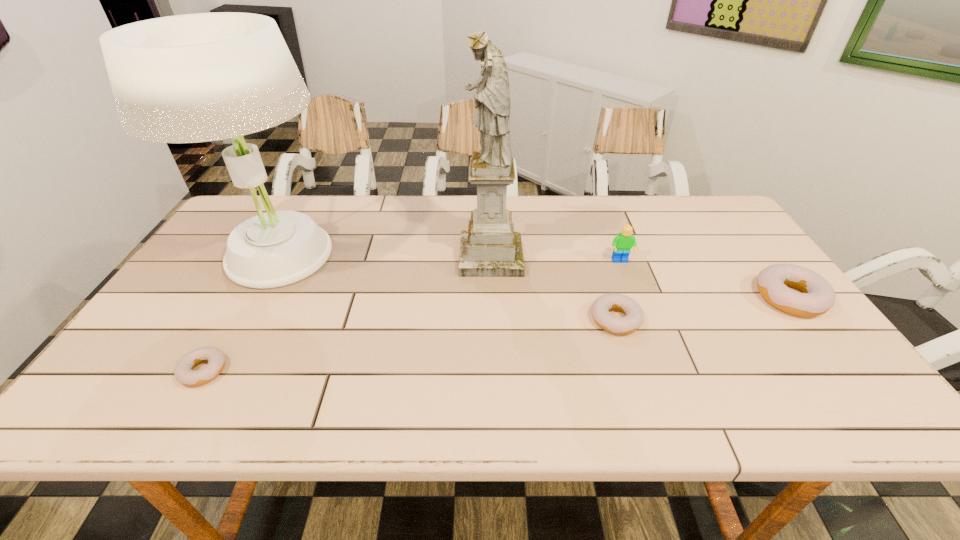
Where is `free space located 0.260m on the right of the second tallest doughnut`? This screenshot has width=960, height=540. free space located 0.260m on the right of the second tallest doughnut is located at coordinates (745, 320).

This screenshot has width=960, height=540. I want to click on free space located on the front of the tallest doughnut, so click(850, 375).

Locate an element on the screen. The height and width of the screenshot is (540, 960). vacant area located 0.340m on the front-facing side of the sculpture is located at coordinates (343, 256).

You are a GUI agent. You are given a task and a screenshot of the screen. Output one action in this format:
    pyautogui.click(x=<x>, y=<y>)
    Task: Click on the free region located on the front-facing side of the sculpture
    
    Given the screenshot: What is the action you would take?
    pyautogui.click(x=384, y=256)

This screenshot has width=960, height=540. I want to click on vacant space located on the front-facing side of the sculpture, so click(x=432, y=256).

Locate an element on the screen. The width and height of the screenshot is (960, 540). vacant point located 0.110m on the front-facing side of the lamp is located at coordinates (233, 337).

Find the location of a particular element. Image resolution: width=960 pixels, height=540 pixels. vacant space located 0.390m on the face of the third tallest object is located at coordinates (664, 379).

Find the location of a particular element. The width and height of the screenshot is (960, 540). object that is positioned at the far edge is located at coordinates click(x=191, y=78).

I want to click on object at the near edge, so click(184, 373).

This screenshot has height=540, width=960. In order to click on doughnut that is at the left edge in this screenshot , I will do `click(184, 373)`.